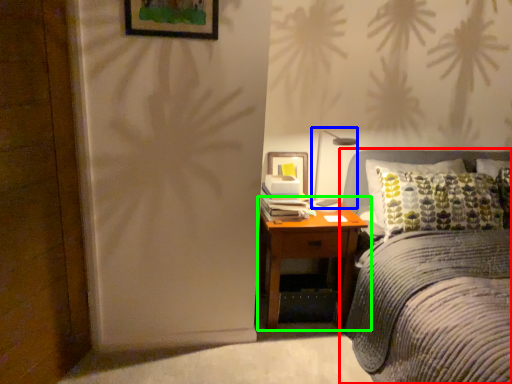
Question: Considering the real-world distances, which object is closest to bed (highlighted by a red box)? bedside lamp (highlighted by a blue box) or nightstand (highlighted by a green box).

Choices:
 (A) bedside lamp
 (B) nightstand

Answer: (B)